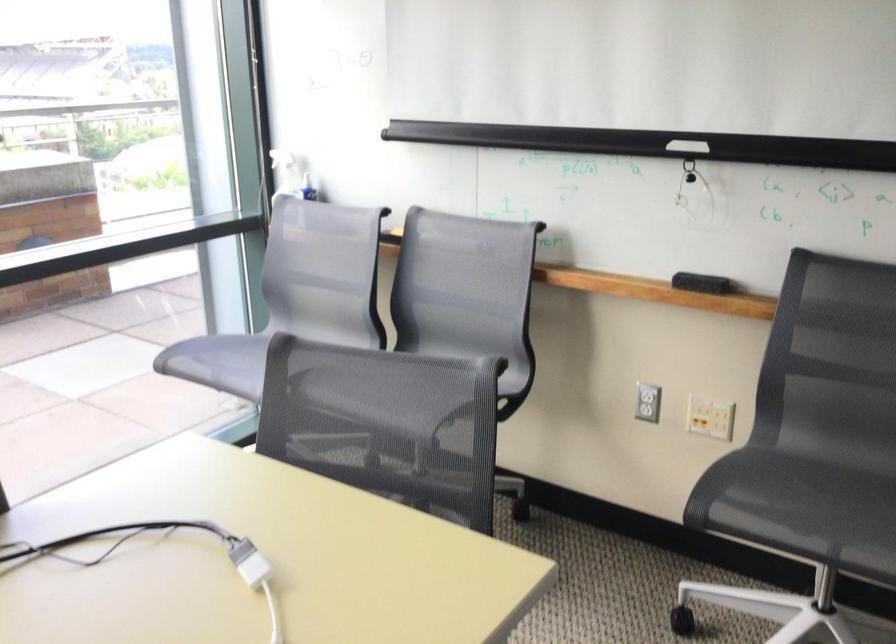
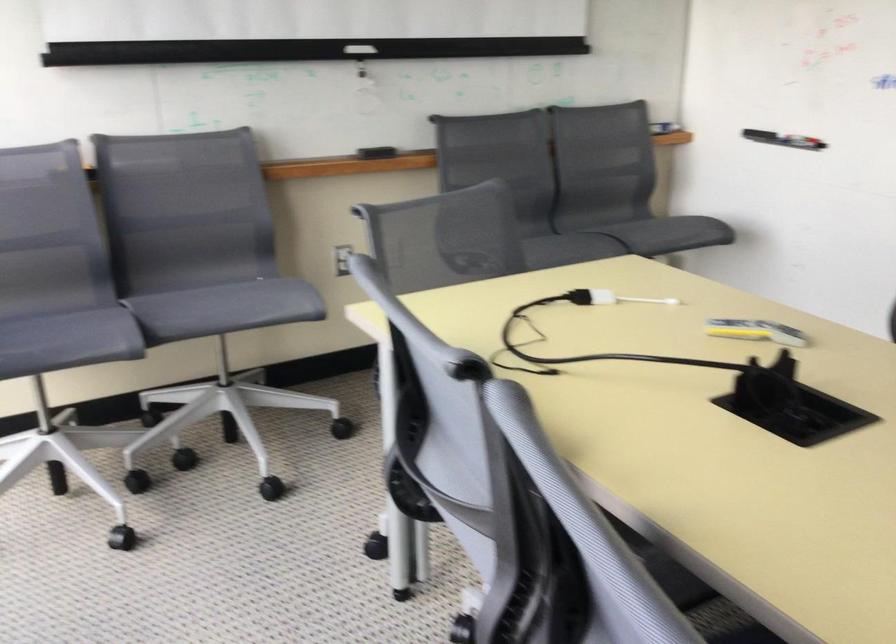
Find the pixel in the second image that matches point (693, 149) in the first image.

(359, 49)